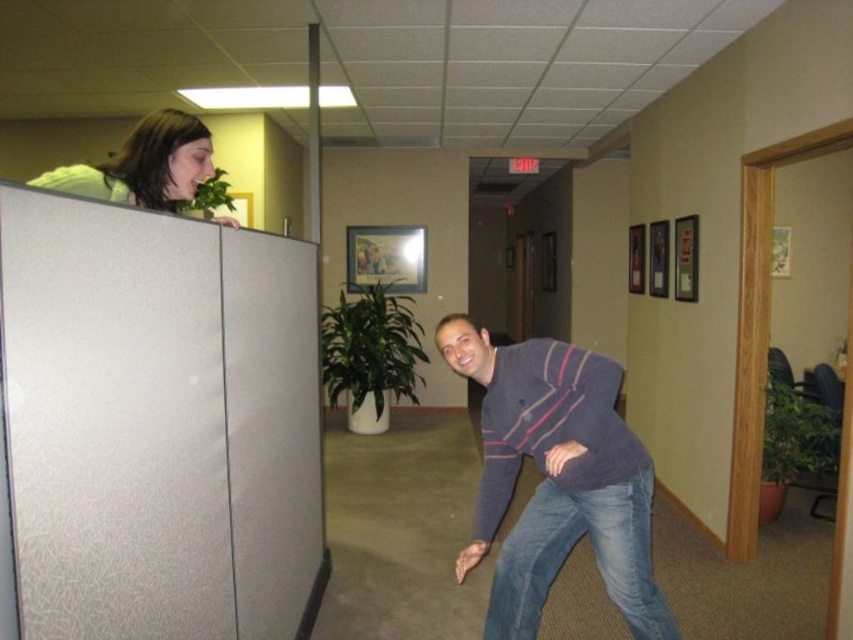
Is dark blue sweater at center shorter than matte white hair at upper left?

Incorrect, dark blue sweater at center's height does not fall short of matte white hair at upper left's.

Can you confirm if dark blue sweater at center is smaller than matte white hair at upper left?

No.

In order to click on dark blue sweater at center in this screenshot , I will do `click(556, 477)`.